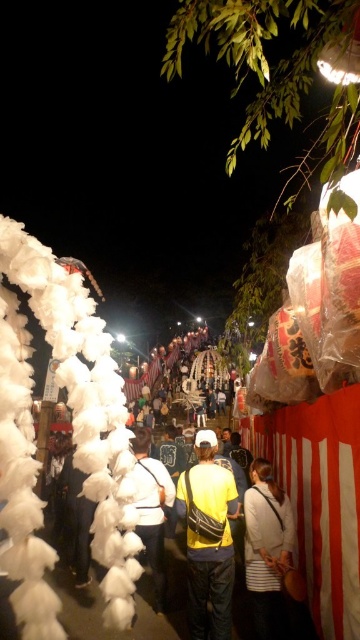
Question: Based on their relative distances, which object is farther from the yellow fabric bag at center?

Choices:
 (A) yellow fabric shirt at center
 (B) white fluffy cotton at left

Answer: (B)

Question: Which point is closer to the camera taking this photo?

Choices:
 (A) (110, 500)
 (B) (200, 634)
 (C) (132, 449)

Answer: (A)

Question: Does white fluffy cotton at left have a lesser width compared to yellow fabric bag at center?

Choices:
 (A) no
 (B) yes

Answer: (A)

Question: Does white fluffy cotton at left appear over yellow fabric bag at center?

Choices:
 (A) yes
 (B) no

Answer: (A)

Question: Is white fluffy cotton at left smaller than yellow fabric bag at center?

Choices:
 (A) yes
 (B) no

Answer: (B)

Question: Which of the following is the closest to the observer?

Choices:
 (A) yellow fabric bag at center
 (B) yellow fabric shirt at center
 (C) white fluffy cotton at left

Answer: (C)